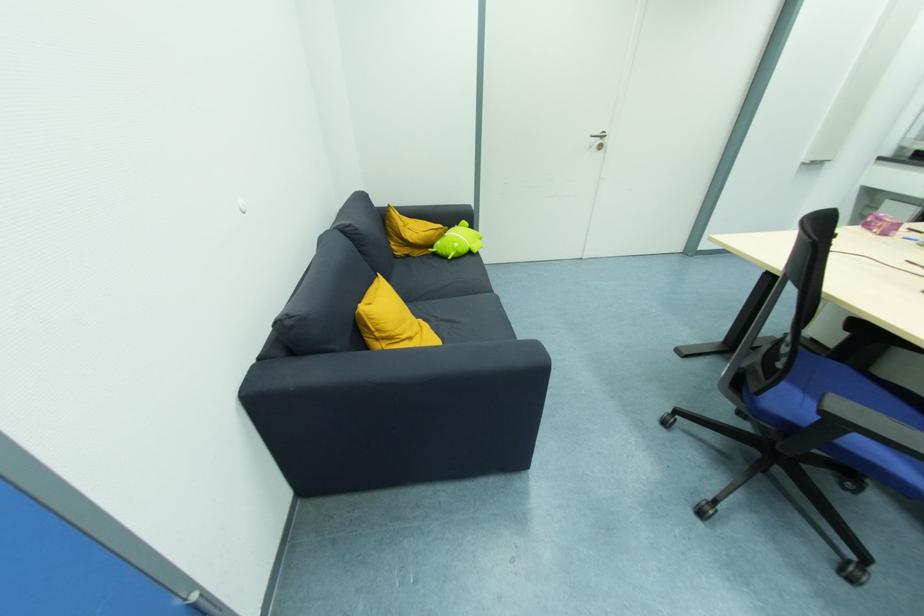
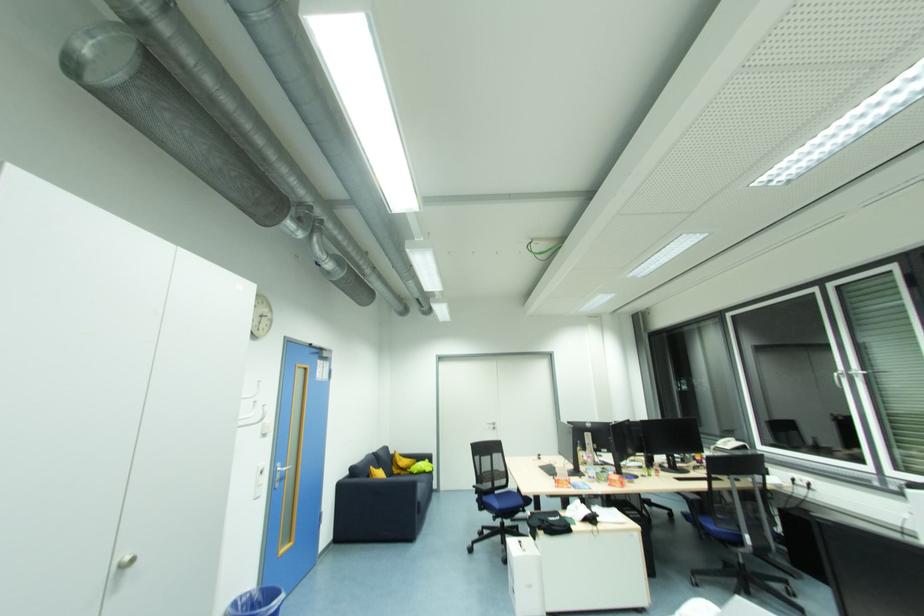
Locate, in the second image, the point that corresponds to (x=403, y=253) in the first image.

(398, 472)